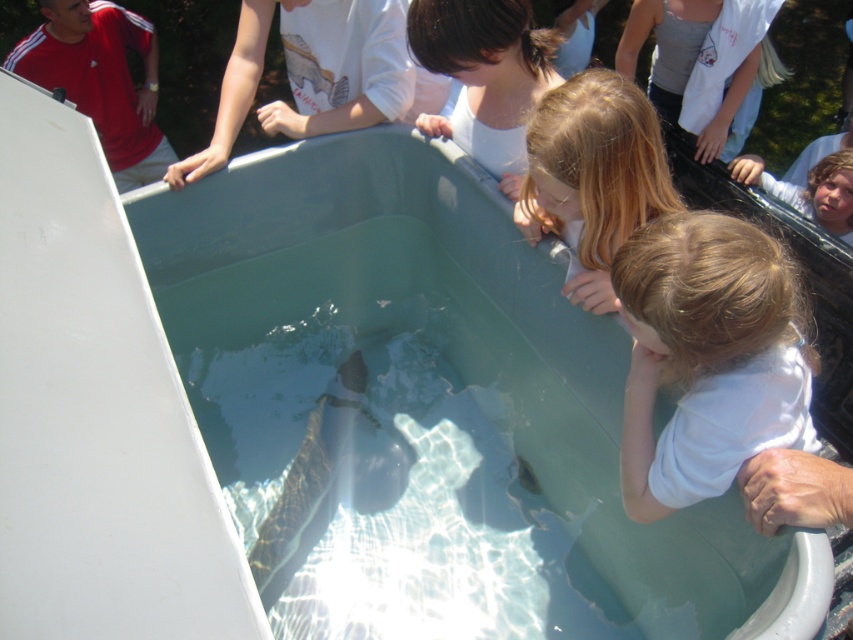
You are a parent at the scene and want to ensure the safety of your child. Considering the height of the clear plastic tub at center and the blonde hair at lower center, is there a risk that the child might accidentally fall into the tub?

The clear plastic tub at center has a greater height compared to blonde hair at lower center, so the tub is taller than the child. This means the edge of the tub is higher than the child, reducing the risk of them falling in accidentally.

You are standing in front of a large white container filled with water where several people are observing a fish. There is a point at coordinates (469, 348). Based on the scene description, can you determine what object this point is pointing to?

The point at coordinates (469, 348) corresponds to the clear plastic tub at center.

You are a photographer trying to capture a clear shot of the light brown hair at lower right and the brown hair at upper center. Which person should you focus on first to ensure they are in frame without overlapping?

You should focus on the brown hair at upper center first because it occupies more space than the light brown hair at lower right, making it easier to position in the frame without overlapping.